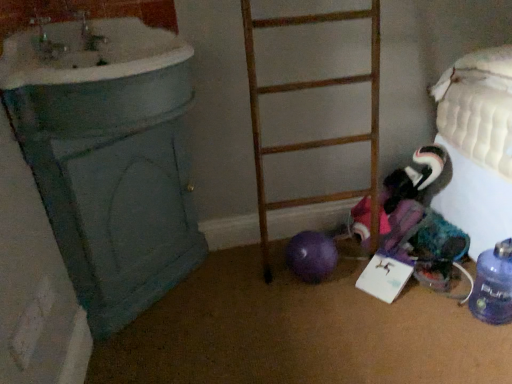
The width and height of the screenshot is (512, 384). I want to click on vacant area that is in front of wooden ladder at center, so click(330, 312).